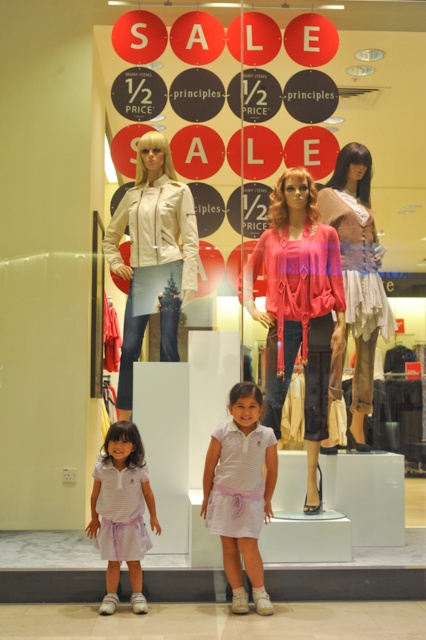
You are a customer looking at the retail display and want to pick up the white striped shirt at center and the white striped dress at center. Which one should you reach for first?

The white striped shirt at center is closer to you, so you should reach for it first before the white striped dress at center.

You are a customer in the mall and want to see the white striped dress at center clearly. However, the matte white jacket at center is blocking your view. Can you move around the display to see it better?

The white striped dress at center is behind the matte white jacket at center, so moving around the display to the side or back might allow you to see it better without obstruction.

You are a customer trying to decide between two dresses displayed in the center of the retail display. The pink satin dress at center and the white striped dress at center. Based on their widths, which dress might require more space to move around comfortably?

The pink satin dress at center might be wider than the white striped dress at center, so it requires more space to move around comfortably.